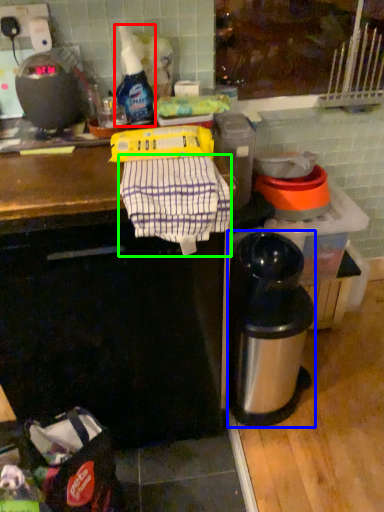
Question: Considering the real-world distances, which object is closest to bottle (highlighted by a red box)? appliance (highlighted by a blue box) or laundry (highlighted by a green box).

Choices:
 (A) appliance
 (B) laundry

Answer: (B)